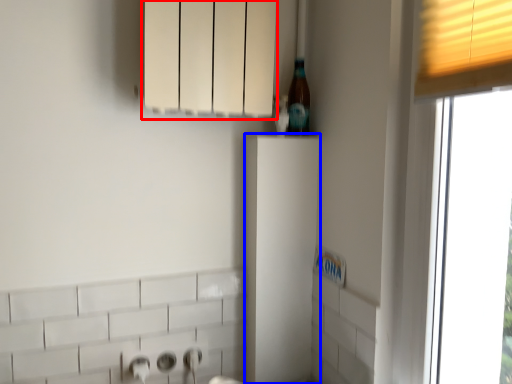
Question: Which of the following is the farthest to the observer, cabinetry (highlighted by a red box) or cabinetry (highlighted by a blue box)?

Choices:
 (A) cabinetry
 (B) cabinetry

Answer: (B)